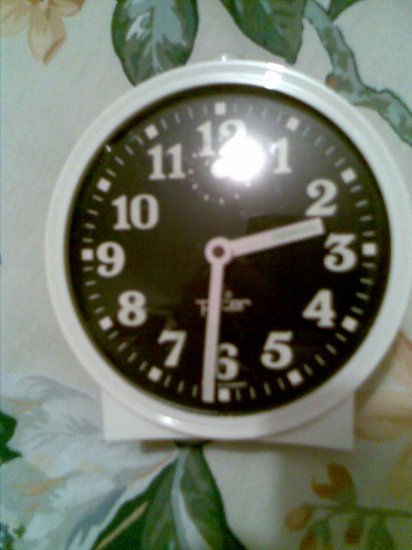
Locate an element on the screen. Image resolution: width=412 pixels, height=550 pixels. shorter clock arm is located at coordinates (257, 242).